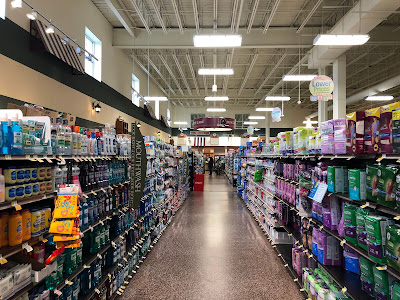
This screenshot has height=300, width=400. Find the location of `ceiling`. ceiling is located at coordinates (206, 16).